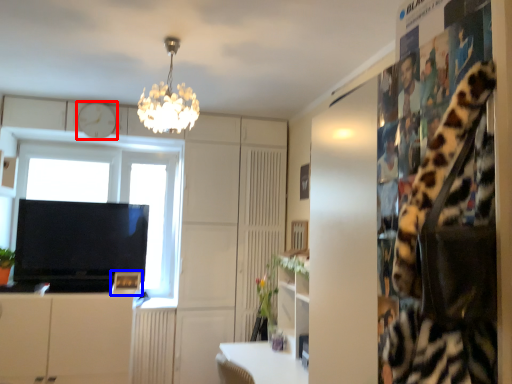
Question: Which object is further to the camera taking this photo, clock (highlighted by a red box) or picture frame (highlighted by a blue box)?

Choices:
 (A) clock
 (B) picture frame

Answer: (A)